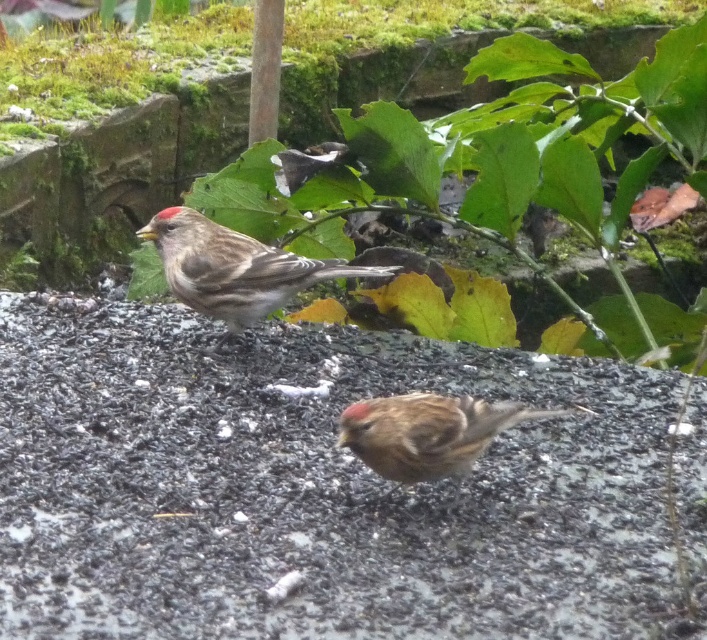
Which is above, gray gravel at center or brown feathered sparrow at center?

brown feathered sparrow at center is above.

Is point (481, 499) positioned before point (409, 400)?

No, (481, 499) is further to viewer.

This screenshot has width=707, height=640. What are the coordinates of `gray gravel at center` in the screenshot? It's located at (325, 488).

Which is above, brown matte sparrow at upper left or brown feathered sparrow at center?

brown matte sparrow at upper left

Between point (173, 228) and point (431, 465), which one is positioned behind?

Positioned behind is point (173, 228).

I want to click on brown matte sparrow at upper left, so click(x=235, y=268).

Does gray gravel at center have a greater width compared to brown matte sparrow at upper left?

Correct, the width of gray gravel at center exceeds that of brown matte sparrow at upper left.

How much distance is there between gray gravel at center and brown matte sparrow at upper left?

gray gravel at center is 11.82 inches from brown matte sparrow at upper left.

Locate an element on the screen. gray gravel at center is located at coordinates (325, 488).